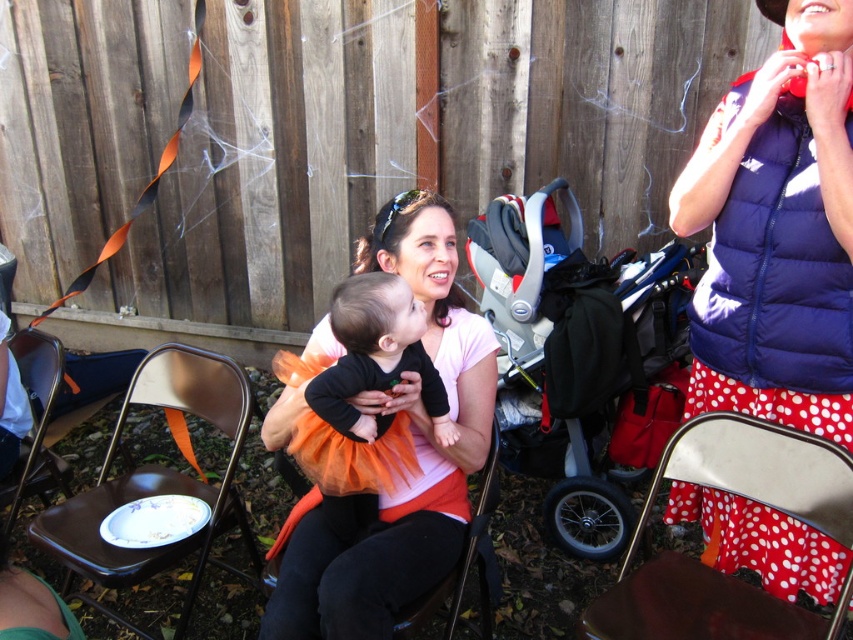
You are a photographer trying to capture a candid shot of the blue puffy vest at upper right and the metallic silver chair at lower right in the scene. The camera you are using has a minimum focus distance of 12 inches. Can you take a clear photo of both objects without moving either of them?

The blue puffy vest at upper right and the metallic silver chair at lower right are 11.96 inches apart from each other. Since the distance between them is less than the camera minimum focus distance of 12 inches, you cannot take a clear photo of both objects without moving them.

You are organizing a costume party and need to decide which item to place first in the storage room. The blue puffy vest at upper right and the metallic silver chair at lower right are both in the storage area. Which item should you move first if you want to prioritize moving larger items first?

The blue puffy vest at upper right is bigger than the metallic silver chair at lower right, so you should move the blue puffy vest at upper right first.